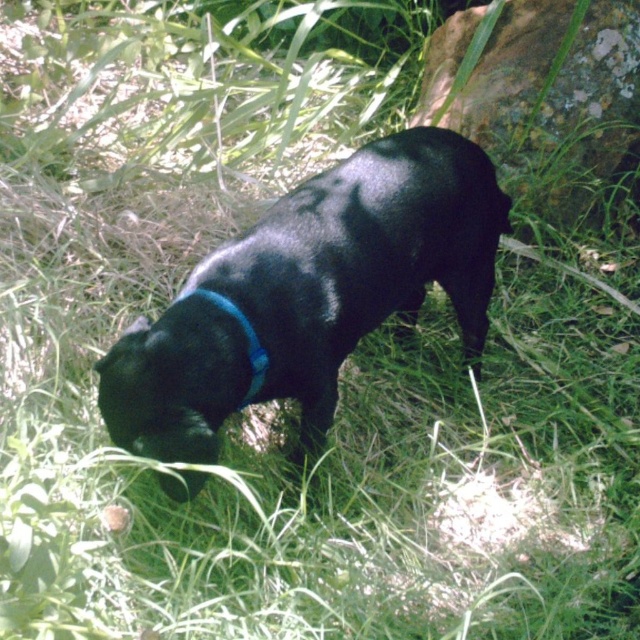
Is point (236, 244) positioned after point (243, 317)?

That is True.

Who is taller, shiny black dog at center or blue fabric neckband at center?

With more height is shiny black dog at center.

Where is `shiny black dog at center`? The image size is (640, 640). shiny black dog at center is located at coordinates (308, 294).

You are a GUI agent. You are given a task and a screenshot of the screen. Output one action in this format:
    pyautogui.click(x=<x>, y=<y>)
    Task: Click on the shiny black dog at center
    
    Given the screenshot: What is the action you would take?
    [x=308, y=294]